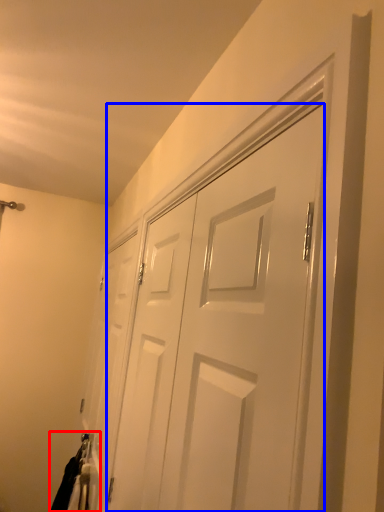
Question: Which point is closer to the camera, laundry (highlighted by a red box) or door (highlighted by a blue box)?

Choices:
 (A) laundry
 (B) door

Answer: (B)